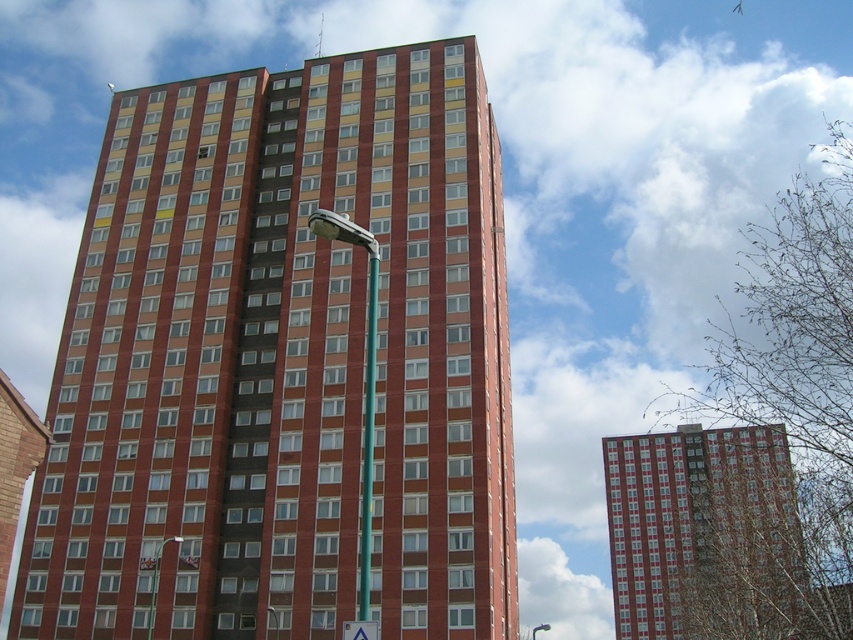
Question: Which of these objects is positioned closest to the teal glossy pole at center?

Choices:
 (A) white plastic triangle at center
 (B) brick textured building at center

Answer: (A)

Question: Is teal glossy pole at center further to the viewer compared to white plastic triangle at center?

Choices:
 (A) no
 (B) yes

Answer: (B)

Question: Which object is closer to the camera taking this photo?

Choices:
 (A) red brick building at center
 (B) white plastic triangle at center
 (C) brick textured building at center

Answer: (B)

Question: Is brick textured building at center below white plastic triangle at center?

Choices:
 (A) no
 (B) yes

Answer: (A)

Question: Can you confirm if teal glossy pole at center is positioned to the right of white plastic triangle at center?

Choices:
 (A) yes
 (B) no

Answer: (A)

Question: Which object is positioned farthest from the red brick building at center?

Choices:
 (A) white plastic triangle at center
 (B) brick textured building at center
 (C) teal glossy pole at center

Answer: (A)